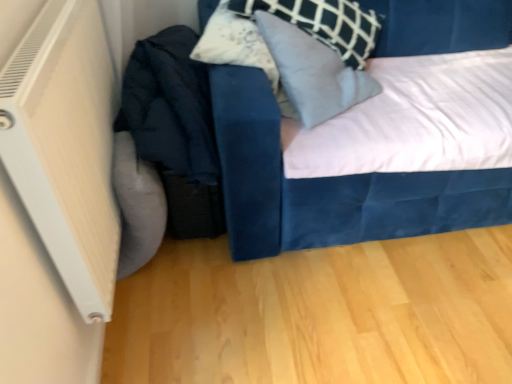
Where is `velvet blue pillow at upper center`? The height and width of the screenshot is (384, 512). velvet blue pillow at upper center is located at coordinates click(313, 72).

From the image's perspective, between white plastic radiator at left and velvet blue pillow at upper center, who is located below?

white plastic radiator at left is shown below in the image.

Which of these two, white plastic radiator at left or velvet blue pillow at upper center, is wider?

Wider between the two is velvet blue pillow at upper center.

Locate an element on the screen. This screenshot has height=384, width=512. pillow on the right of white plastic radiator at left is located at coordinates (313, 72).

Which is behind, point (74, 95) or point (368, 77)?

The point (368, 77) is farther.

From the image's perspective, would you say velvet blue pillow at upper center is shown under velvet blue bed at center?

No, from the image's perspective, velvet blue pillow at upper center is not below velvet blue bed at center.

Is the position of velvet blue pillow at upper center less distant than that of velvet blue bed at center?

No, it is not.

Which of these two, velvet blue pillow at upper center or velvet blue bed at center, is smaller?

velvet blue pillow at upper center is smaller.

Would you say velvet blue bed at center is inside or outside velvet blue pillow at upper center?

velvet blue bed at center is spatially situated outside velvet blue pillow at upper center.

Can you confirm if velvet blue bed at center is positioned to the left of velvet blue pillow at upper center?

In fact, velvet blue bed at center is to the right of velvet blue pillow at upper center.

Relative to velvet blue pillow at upper center, is velvet blue bed at center in front or behind?

Visually, velvet blue bed at center is located in front of velvet blue pillow at upper center.

From a real-world perspective, between velvet blue bed at center and velvet blue pillow at upper center, who is vertically lower?

velvet blue bed at center is physically lower.

Between velvet blue pillow at upper center and white plastic radiator at left, which one has larger width?

velvet blue pillow at upper center is wider.

Between velvet blue pillow at upper center and white plastic radiator at left, which one appears on the right side from the viewer's perspective?

velvet blue pillow at upper center.

Is white plastic radiator at left at the back of velvet blue pillow at upper center?

That's not correct — velvet blue pillow at upper center is not looking away from white plastic radiator at left.

Does velvet blue bed at center turn towards white plastic radiator at left?

No, velvet blue bed at center does not turn towards white plastic radiator at left.

Considering the relative positions of velvet blue bed at center and white plastic radiator at left in the image provided, is velvet blue bed at center in front of white plastic radiator at left?

No, it is not.

Where is `bed below the white plastic radiator at left (from a real-world perspective)`? The height and width of the screenshot is (384, 512). bed below the white plastic radiator at left (from a real-world perspective) is located at coordinates (329, 185).

Is velvet blue bed at center at the back of white plastic radiator at left?

white plastic radiator at left does not have its back to velvet blue bed at center.

From a real-world perspective, does white plastic radiator at left sit lower than velvet blue bed at center?

Actually, white plastic radiator at left is physically above velvet blue bed at center in the real world.

Considering their positions, is white plastic radiator at left located in front of or behind velvet blue bed at center?

Clearly, white plastic radiator at left is in front of velvet blue bed at center.

Where is `pillow above the white plastic radiator at left (from a real-world perspective)`? Image resolution: width=512 pixels, height=384 pixels. pillow above the white plastic radiator at left (from a real-world perspective) is located at coordinates (313, 72).

This screenshot has width=512, height=384. Find the location of `bed in front of the velvet blue pillow at upper center`. bed in front of the velvet blue pillow at upper center is located at coordinates (329, 185).

Considering their positions, is velvet blue bed at center positioned further to white plastic radiator at left than velvet blue pillow at upper center?

velvet blue pillow at upper center lies further to white plastic radiator at left than the other object.

Consider the image. Which object lies nearer to the anchor point velvet blue bed at center, white plastic radiator at left or velvet blue pillow at upper center?

velvet blue pillow at upper center lies closer to velvet blue bed at center than the other object.

Which object lies nearer to the anchor point velvet blue pillow at upper center, white plastic radiator at left or velvet blue bed at center?

velvet blue bed at center is positioned closer to the anchor velvet blue pillow at upper center.

Based on their spatial positions, is velvet blue bed at center or white plastic radiator at left further from velvet blue pillow at upper center?

white plastic radiator at left lies further to velvet blue pillow at upper center than the other object.

Considering their positions, is velvet blue pillow at upper center positioned further to velvet blue bed at center than white plastic radiator at left?

white plastic radiator at left is further to velvet blue bed at center.

When comparing their distances from white plastic radiator at left, does velvet blue pillow at upper center or velvet blue bed at center seem further?

The object further to white plastic radiator at left is velvet blue pillow at upper center.

Find the location of `pillow between white plastic radiator at left and velvet blue bed at center from left to right`. pillow between white plastic radiator at left and velvet blue bed at center from left to right is located at coordinates (313, 72).